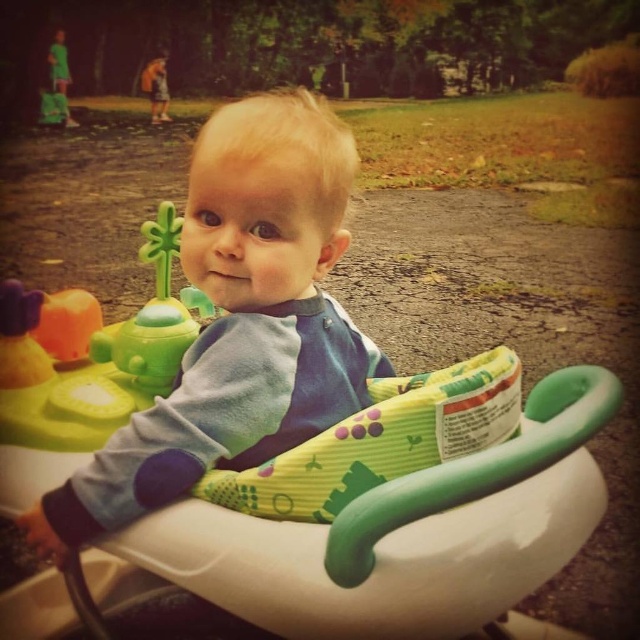
Question: Is blue soft baby at center closer to the viewer compared to green plastic walker at center?

Choices:
 (A) yes
 (B) no

Answer: (B)

Question: Can you confirm if blue soft baby at center is positioned to the left of green plastic toy at center?

Choices:
 (A) no
 (B) yes

Answer: (A)

Question: Which is nearer to the green plastic walker at center?

Choices:
 (A) green plastic toy at center
 (B) blue soft baby at center

Answer: (B)

Question: Which object is the farthest from the green plastic walker at center?

Choices:
 (A) blue soft baby at center
 (B) green plastic toy at center

Answer: (B)

Question: Considering the real-world distances, which object is closest to the green plastic toy at center?

Choices:
 (A) green plastic walker at center
 (B) blue soft baby at center

Answer: (B)

Question: Is blue soft baby at center wider than green plastic walker at center?

Choices:
 (A) no
 (B) yes

Answer: (A)